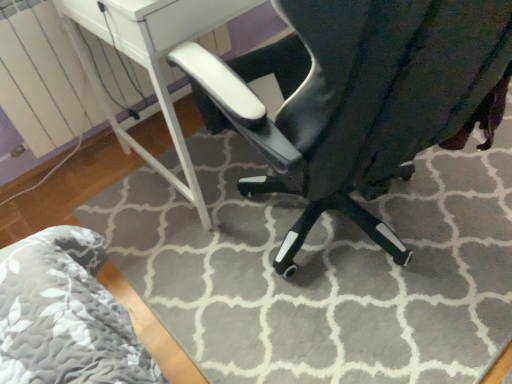
Question: Could white glossy table at center be considered to be inside glossy black chair at center?

Choices:
 (A) no
 (B) yes

Answer: (A)

Question: Is glossy black chair at center not close to white glossy table at center?

Choices:
 (A) yes
 (B) no

Answer: (B)

Question: Is glossy black chair at center thinner than white glossy table at center?

Choices:
 (A) yes
 (B) no

Answer: (B)

Question: From the image's perspective, is glossy black chair at center on top of white glossy table at center?

Choices:
 (A) no
 (B) yes

Answer: (A)

Question: Considering the relative positions of glossy black chair at center and white glossy table at center in the image provided, is glossy black chair at center behind white glossy table at center?

Choices:
 (A) yes
 (B) no

Answer: (B)

Question: Does glossy black chair at center turn towards white glossy table at center?

Choices:
 (A) no
 (B) yes

Answer: (B)

Question: From a real-world perspective, is white glossy table at center physically below glossy black chair at center?

Choices:
 (A) yes
 (B) no

Answer: (A)

Question: Is white glossy table at center oriented away from glossy black chair at center?

Choices:
 (A) no
 (B) yes

Answer: (A)

Question: From the image's perspective, is white glossy table at center on top of glossy black chair at center?

Choices:
 (A) yes
 (B) no

Answer: (A)

Question: Is white glossy table at center facing towards glossy black chair at center?

Choices:
 (A) yes
 (B) no

Answer: (A)

Question: Is white glossy table at center behind glossy black chair at center?

Choices:
 (A) yes
 (B) no

Answer: (A)

Question: Does white glossy table at center have a greater height compared to glossy black chair at center?

Choices:
 (A) no
 (B) yes

Answer: (A)

Question: In the image, is glossy black chair at center positioned in front of or behind white glossy table at center?

Choices:
 (A) front
 (B) behind

Answer: (A)